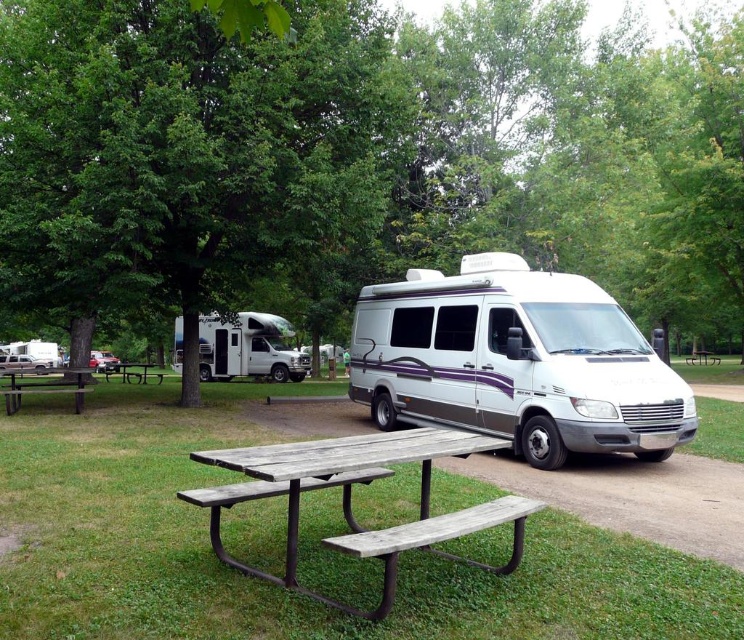
You are a hiker who just arrived at the campground and wants to rest. You see a green leafy tree at center and a weathered wood bench at lower center. Which object is closer to you?

The green leafy tree at center is closer to you because it is further to the viewer than the weathered wood bench at lower center.

You are standing at the origin point of the coordinate system. You want to place a new bench exactly 0.3 units to the right of the weathered wood picnic table at center. What are the coordinates of the new bench?

The coordinates of the new bench would be calculated by adding 0.3 units to the x coordinate of the weathered wood picnic table at center. The original coordinates are at point (x=349, y=499), so adding 0.3 to the x value gives 0.780 0.3 1.080. The new coordinates are therefore (x=349, y=639).